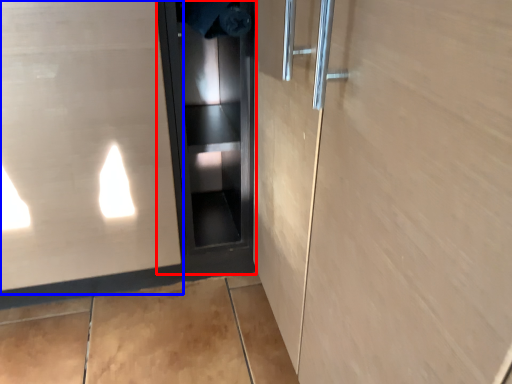
Question: Which of the following is the closest to the observer, elevator door (highlighted by a red box) or elevator door (highlighted by a blue box)?

Choices:
 (A) elevator door
 (B) elevator door

Answer: (B)